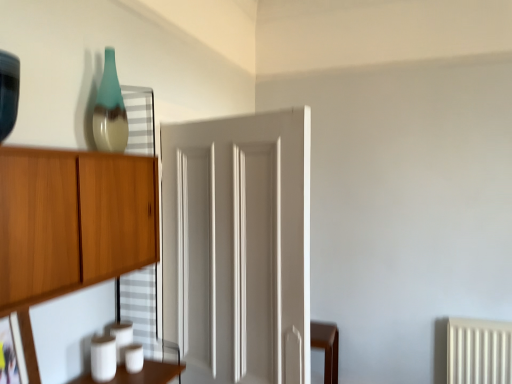
Locate an element on the screen. matte black picture frame at lower left is located at coordinates (11, 352).

Find the location of a particular element. The width and height of the screenshot is (512, 384). matte black picture frame at lower left is located at coordinates (11, 352).

What's the angular difference between teal glass vase at upper left and white painted wood door at center's facing directions?

teal glass vase at upper left and white painted wood door at center are facing 70.3 degrees away from each other.

From the image's perspective, relative to white painted wood door at center, is teal glass vase at upper left above or below?

Based on their image positions, teal glass vase at upper left is located above white painted wood door at center.

Can you confirm if teal glass vase at upper left is positioned to the left of white painted wood door at center?

Result: Yes.

Measure the distance between teal glass vase at upper left and white painted wood door at center.

A distance of 23.91 inches exists between teal glass vase at upper left and white painted wood door at center.

Relative to matte black picture frame at lower left, is white painted wood door at center in front or behind?

Clearly, white painted wood door at center is behind matte black picture frame at lower left.

Is white painted wood door at center not within matte black picture frame at lower left?

That's correct, white painted wood door at center is outside of matte black picture frame at lower left.

From the picture: Can you tell me how much white painted wood door at center and matte black picture frame at lower left differ in facing direction?

They differ by 69.9 degrees in their facing directions.

Who is smaller, white painted wood door at center or matte black picture frame at lower left?

matte black picture frame at lower left is smaller.

Which of these two, matte black picture frame at lower left or teal glass vase at upper left, is bigger?

teal glass vase at upper left is bigger.

Is matte black picture frame at lower left looking in the opposite direction of teal glass vase at upper left?

No.

Identify the location of glass vase lying above the matte black picture frame at lower left (from the image's perspective). This screenshot has height=384, width=512. (110, 110).

Is teal glass vase at upper left inside matte black picture frame at lower left?

No, teal glass vase at upper left is not inside matte black picture frame at lower left.

Looking at this image, is teal glass vase at upper left wider than matte black picture frame at lower left?

Indeed, teal glass vase at upper left has a greater width compared to matte black picture frame at lower left.

In the scene shown: Considering the sizes of objects teal glass vase at upper left and matte black picture frame at lower left in the image provided, who is smaller, teal glass vase at upper left or matte black picture frame at lower left?

With smaller size is matte black picture frame at lower left.

From the image's perspective, which one is positioned higher, teal glass vase at upper left or matte black picture frame at lower left?

teal glass vase at upper left, from the image's perspective.

From a real-world perspective, is teal glass vase at upper left positioned under matte black picture frame at lower left based on gravity?

No.

From a real-world perspective, is white painted wood door at center below teal glass vase at upper left?

Yes, from a real-world perspective, white painted wood door at center is below teal glass vase at upper left.

Locate an element on the screen. This screenshot has width=512, height=384. door that appears below the teal glass vase at upper left (from the image's perspective) is located at coordinates (238, 245).

Can you see white painted wood door at center touching teal glass vase at upper left?

white painted wood door at center is not next to teal glass vase at upper left, and they're not touching.

Based on the photo, is white painted wood door at center situated inside teal glass vase at upper left or outside?

white painted wood door at center is not inside teal glass vase at upper left, it's outside.

Who is smaller, matte black picture frame at lower left or white painted wood door at center?

Smaller between the two is matte black picture frame at lower left.

Is matte black picture frame at lower left not inside white painted wood door at center?

Absolutely, matte black picture frame at lower left is external to white painted wood door at center.

Which is more to the left, matte black picture frame at lower left or white painted wood door at center?

matte black picture frame at lower left.

From the image's perspective, who appears lower, matte black picture frame at lower left or white painted wood door at center?

matte black picture frame at lower left.

This screenshot has height=384, width=512. In the image, there is a teal glass vase at upper left. Identify the location of door below it (from the image's perspective). (238, 245).

The width and height of the screenshot is (512, 384). I want to click on door above the matte black picture frame at lower left (from the image's perspective), so click(238, 245).

Looking at the image, which one is located further to teal glass vase at upper left, white painted wood door at center or matte black picture frame at lower left?

matte black picture frame at lower left is positioned further to the anchor teal glass vase at upper left.

Considering their positions, is white painted wood door at center positioned further to matte black picture frame at lower left than teal glass vase at upper left?

white painted wood door at center.

Considering their positions, is teal glass vase at upper left positioned further to matte black picture frame at lower left than white painted wood door at center?

Among the two, white painted wood door at center is located further to matte black picture frame at lower left.

Estimate the real-world distances between objects in this image. Which object is closer to teal glass vase at upper left, matte black picture frame at lower left or white painted wood door at center?

white painted wood door at center.

Based on their spatial positions, is matte black picture frame at lower left or teal glass vase at upper left closer to white painted wood door at center?

teal glass vase at upper left lies closer to white painted wood door at center than the other object.

Consider the image. When comparing their distances from white painted wood door at center, does teal glass vase at upper left or matte black picture frame at lower left seem further?

matte black picture frame at lower left.

Locate an element on the screen. door that lies between teal glass vase at upper left and matte black picture frame at lower left from top to bottom is located at coordinates (238, 245).